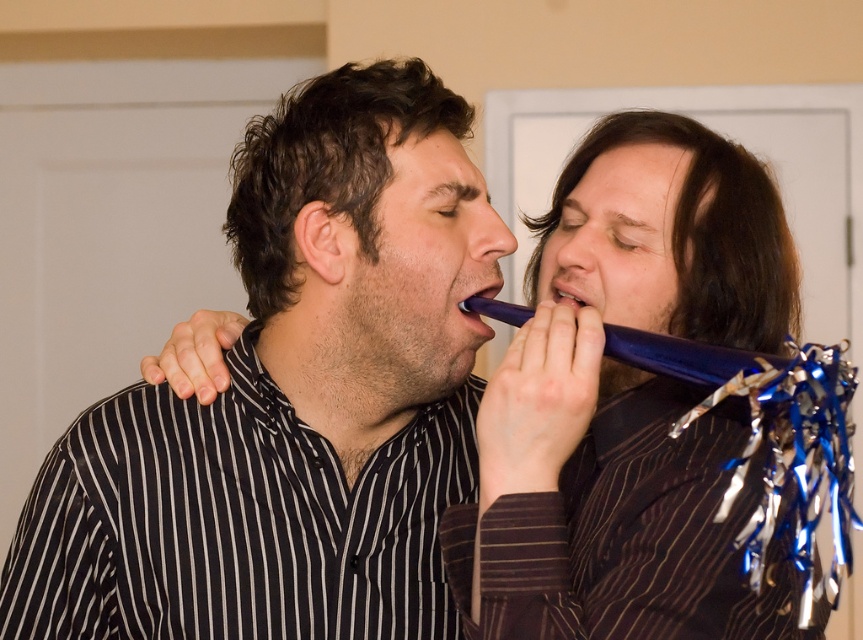
You are a dentist examining a patient. You notice a small point marked at coordinates (681, 356) in the image. What object is located at this point?

The point at coordinates (681, 356) marks the location of the matte blue plastic toothbrush at upper right.